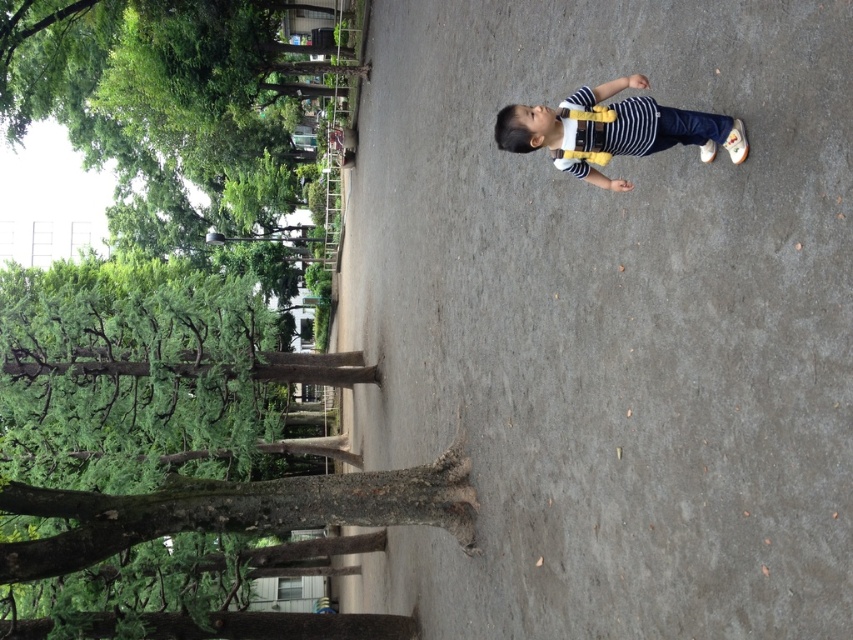
You are a photographer standing in the park. You want to take a picture of the gray concrete at center and the white matte suspenders at center. Which object should you focus on first if you want both to be in sharp focus?

The gray concrete at center is closer to the viewer than the white matte suspenders at center. To have both in sharp focus, you should focus on the white matte suspenders at center, as focusing on the farther object allows for greater depth of field coverage.

You are a parent trying to ensure your child can safely walk across the gray concrete at center without bumping their head on the brown rough tree trunk at center. Based on the scene, is the concrete area tall enough for the child to pass through comfortably?

The gray concrete at center is shorter than the brown rough tree trunk at center, so the concrete area is not tall enough for the child to pass through comfortably without bumping their head. The tree trunk is taller than the concrete, so there might be a risk of collision.

You are a parent trying to ensure your child stays within a safe distance from the brown rough tree trunk at center and the white matte suspenders at center. Based on the scene, which object is wider and requires more caution to avoid?

The brown rough tree trunk at center is wider than the white matte suspenders at center, so it requires more caution to avoid.